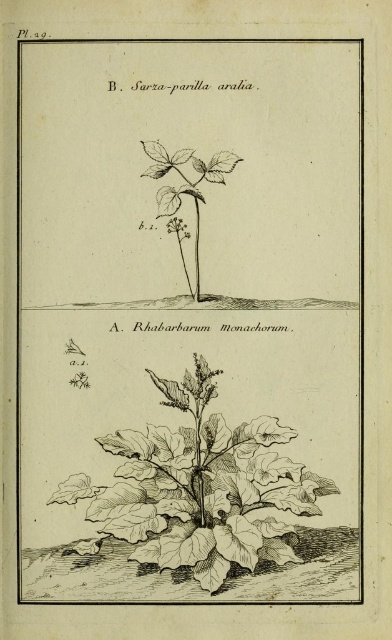
Question: Which object appears closest to the camera in this image?

Choices:
 (A) green leafy plant at center
 (B) brown textured plant at lower center

Answer: (B)

Question: Is brown textured plant at lower center in front of green leafy plant at center?

Choices:
 (A) no
 (B) yes

Answer: (B)

Question: Considering the relative positions of brown textured plant at lower center and green leafy plant at center in the image provided, where is brown textured plant at lower center located with respect to green leafy plant at center?

Choices:
 (A) left
 (B) right

Answer: (B)

Question: Is brown textured plant at lower center wider than green leafy plant at center?

Choices:
 (A) no
 (B) yes

Answer: (B)

Question: Which object appears farthest from the camera in this image?

Choices:
 (A) green leafy plant at center
 (B) brown textured plant at lower center

Answer: (A)

Question: Which object is farther from the camera taking this photo?

Choices:
 (A) green leafy plant at center
 (B) brown textured plant at lower center

Answer: (A)